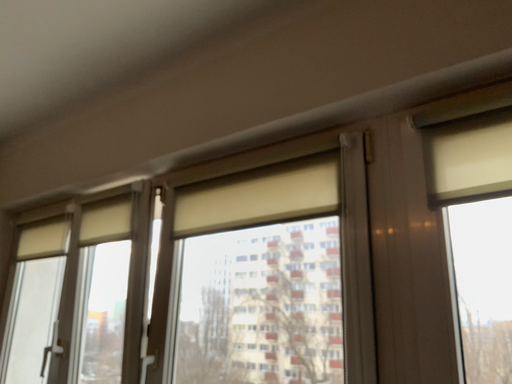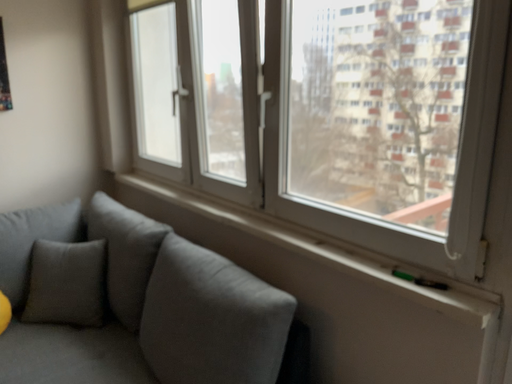
Question: How did the camera likely rotate when shooting the video?

Choices:
 (A) rotated upward
 (B) rotated downward

Answer: (B)